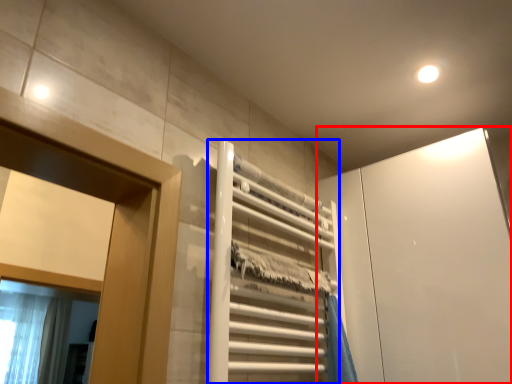
Question: Among these objects, which one is farthest to the camera, screen door (highlighted by a red box) or elevator (highlighted by a blue box)?

Choices:
 (A) screen door
 (B) elevator

Answer: (A)